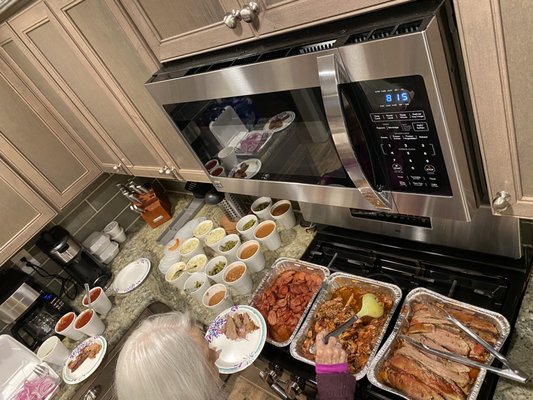
I want to click on cabinets, so click(x=113, y=115), click(x=42, y=157), click(x=16, y=202).